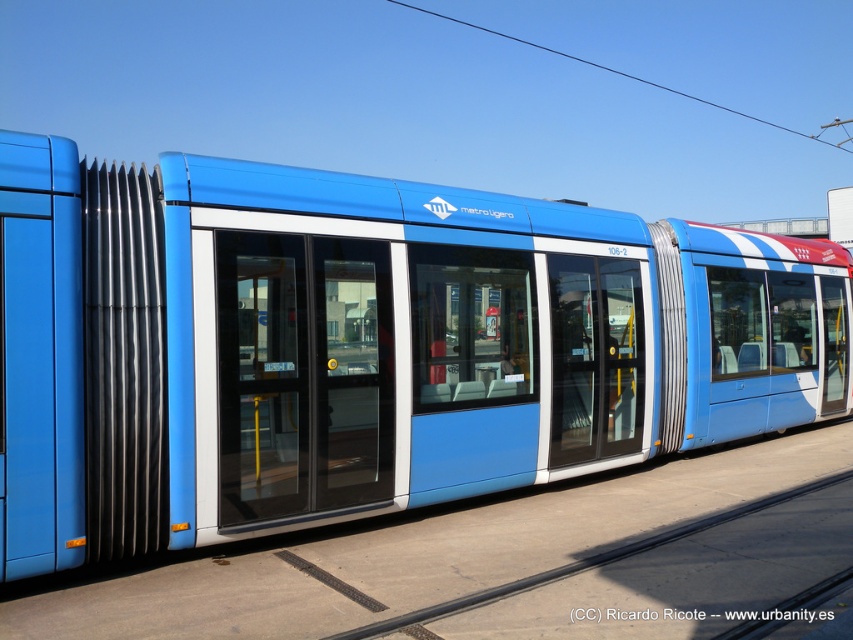
You are a passenger waiting on the platform and see the matte blue train at center and the black rubber train track at center. Which object is closer to the edge of the platform?

The matte blue train at center is positioned on the right side of the black rubber train track at center, so the black rubber train track at center is closer to the edge of the platform.

You are a maintenance worker checking the dimensions of the matte blue train at center and the black rubber train track at center. Which object has a greater width?

The matte blue train at center has a greater width than the black rubber train track at center according to the description.

You are standing on the platform of the ML metro ligero train. You notice two points marked on the train. One is at point coordinates point (67, 412) and the other at point (751, 508). Which point is closer to you?

Point (67, 412) is closer to the viewer than point (751, 508).